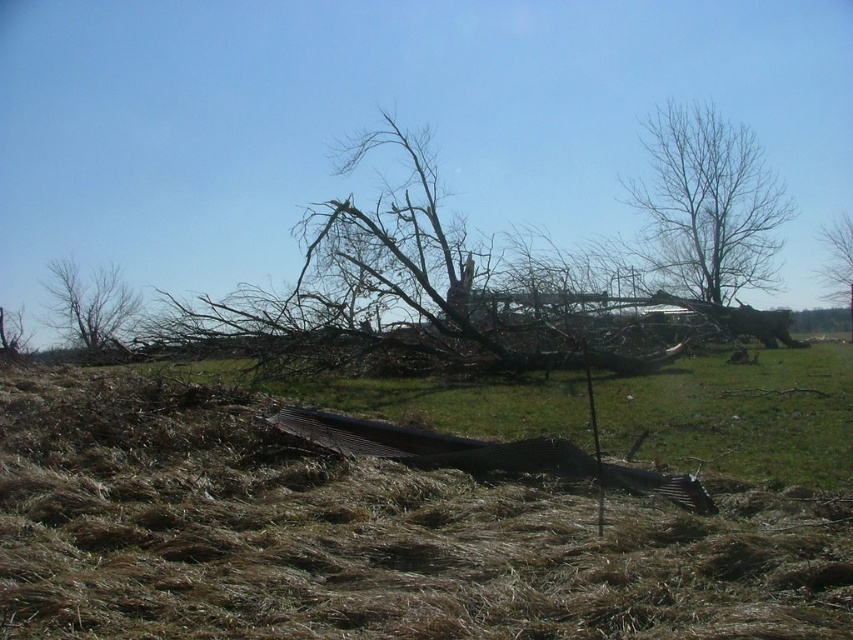
Question: Which point appears farthest from the camera in this image?

Choices:
 (A) (392, 292)
 (B) (715, 422)

Answer: (A)

Question: Can you confirm if brown dry grass at center is bigger than bare branches at upper right?

Choices:
 (A) no
 (B) yes

Answer: (A)

Question: Which object is the farthest from the bare branches at left?

Choices:
 (A) bare branches at right
 (B) brown/dry wood at center
 (C) brown dry grass at lower center

Answer: (A)

Question: From the image, what is the correct spatial relationship of brown dry grass at lower center in relation to bare branches at left?

Choices:
 (A) left
 (B) right

Answer: (B)

Question: Does brown/dry wood at center appear on the right side of bare branches at right?

Choices:
 (A) no
 (B) yes

Answer: (A)

Question: Based on their relative distances, which object is farther from the bare branches at right?

Choices:
 (A) brown dry grass at center
 (B) bare branches at upper right
 (C) bare branches at left
 (D) brown/dry wood at center

Answer: (A)